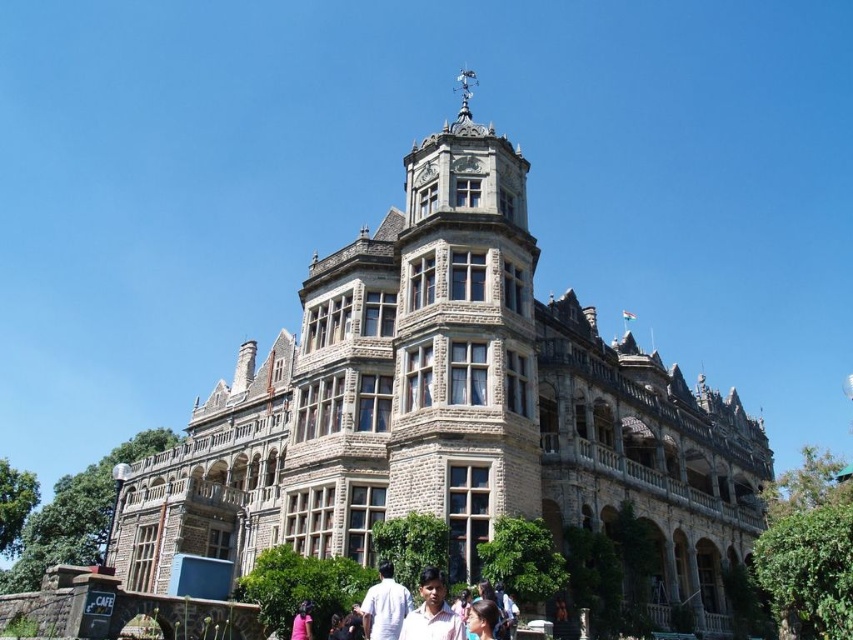
Between stone castle at center and white cotton shirt at center, which one appears on the left side from the viewer's perspective?

From the viewer's perspective, white cotton shirt at center appears more on the left side.

You are a GUI agent. You are given a task and a screenshot of the screen. Output one action in this format:
    pyautogui.click(x=<x>, y=<y>)
    Task: Click on the stone castle at center
    
    Given the screenshot: What is the action you would take?
    pyautogui.click(x=451, y=408)

Find the location of a particular element. stone tower at center is located at coordinates (463, 339).

Between stone tower at center and white cotton shirt at center, which one is positioned lower?

white cotton shirt at center is lower down.

This screenshot has width=853, height=640. What are the coordinates of `stone tower at center` in the screenshot? It's located at (463, 339).

Where is `stone tower at center`? stone tower at center is located at coordinates (463, 339).

Is stone tower at center closer to the viewer compared to pink fabric shirt at center?

No.

Does stone tower at center have a greater width compared to pink fabric shirt at center?

Yes, stone tower at center is wider than pink fabric shirt at center.

Between point (451, 250) and point (431, 627), which one is positioned in front?

Point (431, 627) is more forward.

Where is `stone tower at center`? This screenshot has width=853, height=640. stone tower at center is located at coordinates (463, 339).